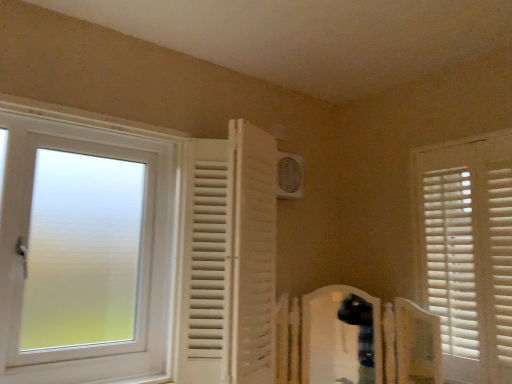
What do you see at coordinates (135, 253) in the screenshot? I see `white frosted glass window at left, the 1th window from the left` at bounding box center [135, 253].

Describe the element at coordinates (467, 252) in the screenshot. This screenshot has width=512, height=384. I see `white wooden blinds at right, which ranks as the second window in left-to-right order` at that location.

What are the coordinates of `white plastic air conditioning unit at upper center` in the screenshot? It's located at (289, 176).

From a real-world perspective, is white wooden blinds at right, which ranks as the second window in left-to-right order, positioned under white frosted glass window at left, the 1th window from the left, based on gravity?

No, from a real-world perspective, white wooden blinds at right, which ranks as the second window in left-to-right order, is not below white frosted glass window at left, the 1th window from the left.

Can you see white wooden blinds at right, which is the first window from right to left, touching white frosted glass window at left, the 1th window from the left?

No, white wooden blinds at right, which is the first window from right to left, is not next to white frosted glass window at left, the 1th window from the left.

Considering the sizes of white wooden blinds at right, which ranks as the second window in left-to-right order, and white frosted glass window at left, the 1th window from the left, in the image, is white wooden blinds at right, which ranks as the second window in left-to-right order, bigger or smaller than white frosted glass window at left, the 1th window from the left,?

Clearly, white wooden blinds at right, which ranks as the second window in left-to-right order, is smaller in size than white frosted glass window at left, the 1th window from the left.

Is white wooden blinds at right, which is the first window from right to left, not within white frosted glass window at left, which is the second window in right-to-left order?

Yes, white wooden blinds at right, which is the first window from right to left, is located beyond the bounds of white frosted glass window at left, which is the second window in right-to-left order.

Looking at this image, is white plastic air conditioning unit at upper center outside of white frosted glass window at left, the 1th window from the left?

white plastic air conditioning unit at upper center is positioned outside white frosted glass window at left, the 1th window from the left.

Considering the relative positions of white plastic air conditioning unit at upper center and white frosted glass window at left, which is the second window in right-to-left order, in the image provided, is white plastic air conditioning unit at upper center to the left of white frosted glass window at left, which is the second window in right-to-left order, from the viewer's perspective?

In fact, white plastic air conditioning unit at upper center is to the right of white frosted glass window at left, which is the second window in right-to-left order.

Is white plastic air conditioning unit at upper center wider than white frosted glass window at left, which is the second window in right-to-left order?

In fact, white plastic air conditioning unit at upper center might be narrower than white frosted glass window at left, which is the second window in right-to-left order.

From the picture: Considering the relative sizes of white plastic air conditioning unit at upper center and white frosted glass window at left, which is the second window in right-to-left order, in the image provided, is white plastic air conditioning unit at upper center smaller than white frosted glass window at left, which is the second window in right-to-left order,?

Correct, white plastic air conditioning unit at upper center occupies less space than white frosted glass window at left, which is the second window in right-to-left order.

Identify the location of window on the left of white wooden blinds at right, which is the first window from right to left. The height and width of the screenshot is (384, 512). (135, 253).

Which object is thinner, white frosted glass window at left, the 1th window from the left, or white wooden blinds at right, which is the first window from right to left?

white wooden blinds at right, which is the first window from right to left, is thinner.

Could you tell me if white frosted glass window at left, the 1th window from the left, is turned towards white wooden blinds at right, which is the first window from right to left?

No, white frosted glass window at left, the 1th window from the left, is not facing towards white wooden blinds at right, which is the first window from right to left.

Is white frosted glass window at left, the 1th window from the left, spatially inside white plastic air conditioning unit at upper center, or outside of it?

white frosted glass window at left, the 1th window from the left, is located beyond the bounds of white plastic air conditioning unit at upper center.

Considering their positions, is white frosted glass window at left, which is the second window in right-to-left order, located in front of or behind white plastic air conditioning unit at upper center?

white frosted glass window at left, which is the second window in right-to-left order, is in front of white plastic air conditioning unit at upper center.

Identify the location of air conditioning above the white frosted glass window at left, the 1th window from the left (from the image's perspective). Image resolution: width=512 pixels, height=384 pixels. (289, 176).

Considering the positions of objects white plastic air conditioning unit at upper center and white wooden blinds at right, which is the first window from right to left, in the image provided, who is in front, white plastic air conditioning unit at upper center or white wooden blinds at right, which is the first window from right to left,?

white wooden blinds at right, which is the first window from right to left, is closer to the camera.

Considering the relative sizes of white plastic air conditioning unit at upper center and white wooden blinds at right, which is the first window from right to left, in the image provided, is white plastic air conditioning unit at upper center thinner than white wooden blinds at right, which is the first window from right to left,?

Yes, white plastic air conditioning unit at upper center is thinner than white wooden blinds at right, which is the first window from right to left.

Consider the image. In the image, is white plastic air conditioning unit at upper center on the left side or the right side of white wooden blinds at right, which is the first window from right to left?

white plastic air conditioning unit at upper center is to the left of white wooden blinds at right, which is the first window from right to left.

Is white plastic air conditioning unit at upper center touching white wooden blinds at right, which ranks as the second window in left-to-right order?

There is a gap between white plastic air conditioning unit at upper center and white wooden blinds at right, which ranks as the second window in left-to-right order.

From a real-world perspective, is white wooden blinds at right, which ranks as the second window in left-to-right order, located beneath white plastic air conditioning unit at upper center?

Indeed, from a real-world perspective, white wooden blinds at right, which ranks as the second window in left-to-right order, is positioned beneath white plastic air conditioning unit at upper center.

Considering the sizes of objects white wooden blinds at right, which is the first window from right to left, and white plastic air conditioning unit at upper center in the image provided, who is taller, white wooden blinds at right, which is the first window from right to left, or white plastic air conditioning unit at upper center?

With more height is white wooden blinds at right, which is the first window from right to left.

Relative to white plastic air conditioning unit at upper center, is white wooden blinds at right, which is the first window from right to left, in front or behind?

Visually, white wooden blinds at right, which is the first window from right to left, is located in front of white plastic air conditioning unit at upper center.

Which is more to the right, white wooden blinds at right, which is the first window from right to left, or white plastic air conditioning unit at upper center?

From the viewer's perspective, white wooden blinds at right, which is the first window from right to left, appears more on the right side.

Find the location of a particular element. The height and width of the screenshot is (384, 512). window below the white frosted glass window at left, the 1th window from the left (from the image's perspective) is located at coordinates (467, 252).

You are a GUI agent. You are given a task and a screenshot of the screen. Output one action in this format:
    pyautogui.click(x=<x>, y=<y>)
    Task: Click on the air conditioning located above the white frosted glass window at left, the 1th window from the left (from the image's perspective)
    
    Given the screenshot: What is the action you would take?
    pyautogui.click(x=289, y=176)

Estimate the real-world distances between objects in this image. Which object is closer to white frosted glass window at left, which is the second window in right-to-left order, white plastic air conditioning unit at upper center or white wooden blinds at right, which ranks as the second window in left-to-right order?

Among the two, white plastic air conditioning unit at upper center is located nearer to white frosted glass window at left, which is the second window in right-to-left order.

Estimate the real-world distances between objects in this image. Which object is closer to white frosted glass window at left, the 1th window from the left, white wooden blinds at right, which is the first window from right to left, or white plastic air conditioning unit at upper center?

Among the two, white plastic air conditioning unit at upper center is located nearer to white frosted glass window at left, the 1th window from the left.

When comparing their distances from white wooden blinds at right, which ranks as the second window in left-to-right order, does white frosted glass window at left, the 1th window from the left, or white plastic air conditioning unit at upper center seem closer?

white plastic air conditioning unit at upper center lies closer to white wooden blinds at right, which ranks as the second window in left-to-right order, than the other object.

Looking at the image, which one is located closer to white plastic air conditioning unit at upper center, white frosted glass window at left, which is the second window in right-to-left order, or white wooden blinds at right, which is the first window from right to left?

white frosted glass window at left, which is the second window in right-to-left order, lies closer to white plastic air conditioning unit at upper center than the other object.

Which object lies nearer to the anchor point white plastic air conditioning unit at upper center, white wooden blinds at right, which ranks as the second window in left-to-right order, or white frosted glass window at left, which is the second window in right-to-left order?

white frosted glass window at left, which is the second window in right-to-left order.

Estimate the real-world distances between objects in this image. Which object is closer to white wooden blinds at right, which is the first window from right to left, white plastic air conditioning unit at upper center or white frosted glass window at left, the 1th window from the left?

white plastic air conditioning unit at upper center is positioned closer to the anchor white wooden blinds at right, which is the first window from right to left.

Locate an element on the screen. air conditioning situated between white frosted glass window at left, the 1th window from the left, and white wooden blinds at right, which ranks as the second window in left-to-right order, from left to right is located at coordinates (289, 176).